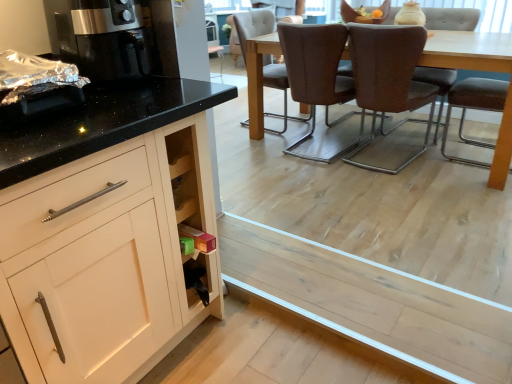
Question: Is satin black coffee machine at left far from brown leather chair at center, the 1th chair when ordered from right to left?

Choices:
 (A) yes
 (B) no

Answer: (A)

Question: Does satin black coffee machine at left lie in front of brown leather chair at center, the 1th chair when ordered from right to left?

Choices:
 (A) yes
 (B) no

Answer: (A)

Question: Considering the relative sizes of satin black coffee machine at left and brown leather chair at center, the fifth chair when ordered from left to right, in the image provided, is satin black coffee machine at left smaller than brown leather chair at center, the fifth chair when ordered from left to right,?

Choices:
 (A) yes
 (B) no

Answer: (A)

Question: Can you confirm if satin black coffee machine at left is shorter than brown leather chair at center, the fifth chair when ordered from left to right?

Choices:
 (A) no
 (B) yes

Answer: (B)

Question: From a real-world perspective, is satin black coffee machine at left on top of brown leather chair at center, the 1th chair when ordered from right to left?

Choices:
 (A) no
 (B) yes

Answer: (B)

Question: From a real-world perspective, is brown fabric chair at center, the 5th chair positioned from the right, above or below light wood plank at lower center?

Choices:
 (A) above
 (B) below

Answer: (A)

Question: Considering the positions of brown fabric chair at center, the 1th chair positioned from the left, and light wood plank at lower center in the image, is brown fabric chair at center, the 1th chair positioned from the left, bigger or smaller than light wood plank at lower center?

Choices:
 (A) big
 (B) small

Answer: (A)

Question: Considering the positions of brown fabric chair at center, the 1th chair positioned from the left, and light wood plank at lower center in the image, is brown fabric chair at center, the 1th chair positioned from the left, wider or thinner than light wood plank at lower center?

Choices:
 (A) wide
 (B) thin

Answer: (A)

Question: Is brown fabric chair at center, the 1th chair positioned from the left, inside the boundaries of light wood plank at lower center, or outside?

Choices:
 (A) inside
 (B) outside

Answer: (B)

Question: In the image, is brown leather chair at center, placed as the 3th chair when sorted from right to left, on the left side or the right side of satin black coffee machine at left?

Choices:
 (A) left
 (B) right

Answer: (B)

Question: Is brown leather chair at center, the third chair positioned from the left, wider or thinner than satin black coffee machine at left?

Choices:
 (A) thin
 (B) wide

Answer: (B)

Question: In terms of height, does brown leather chair at center, the third chair positioned from the left, look taller or shorter compared to satin black coffee machine at left?

Choices:
 (A) short
 (B) tall

Answer: (B)

Question: Is point (381, 79) closer or farther from the camera than point (114, 44)?

Choices:
 (A) farther
 (B) closer

Answer: (A)

Question: Is brown leather chair at center, the 1th chair when ordered from right to left, inside or outside of light wood plank at lower center?

Choices:
 (A) inside
 (B) outside

Answer: (B)

Question: Considering the positions of brown leather chair at center, the fifth chair when ordered from left to right, and light wood plank at lower center in the image, is brown leather chair at center, the fifth chair when ordered from left to right, bigger or smaller than light wood plank at lower center?

Choices:
 (A) big
 (B) small

Answer: (A)